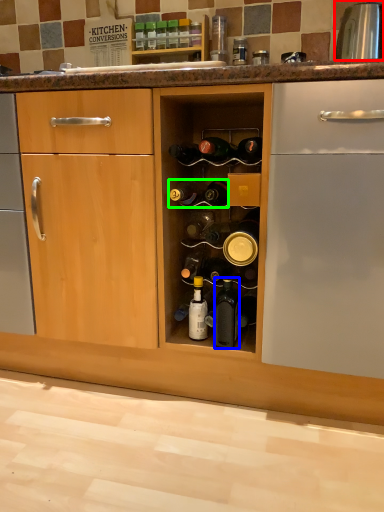
Question: Estimate the real-world distances between objects in this image. Which object is closer to appliance (highlighted by a red box), bottle (highlighted by a blue box) or bottle (highlighted by a green box)?

Choices:
 (A) bottle
 (B) bottle

Answer: (B)